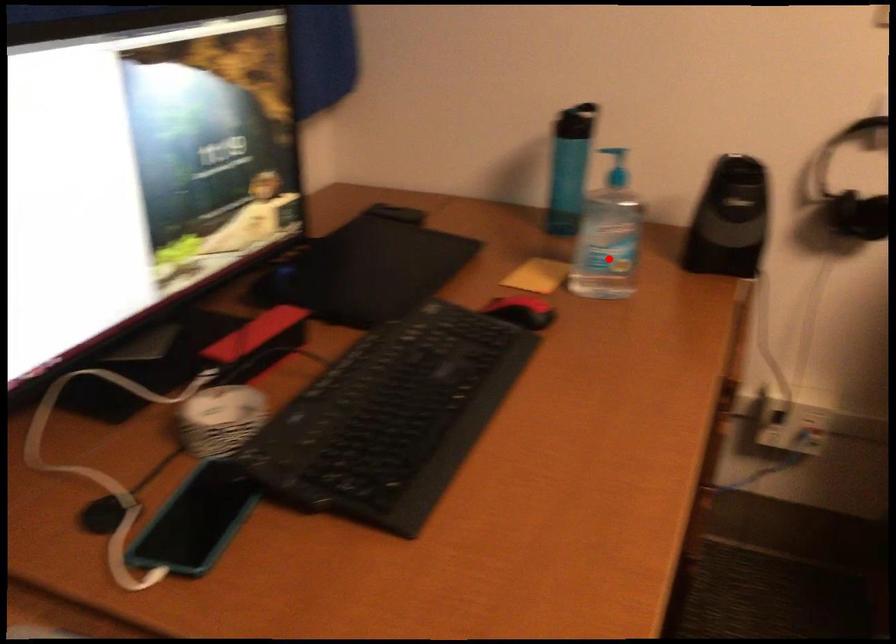
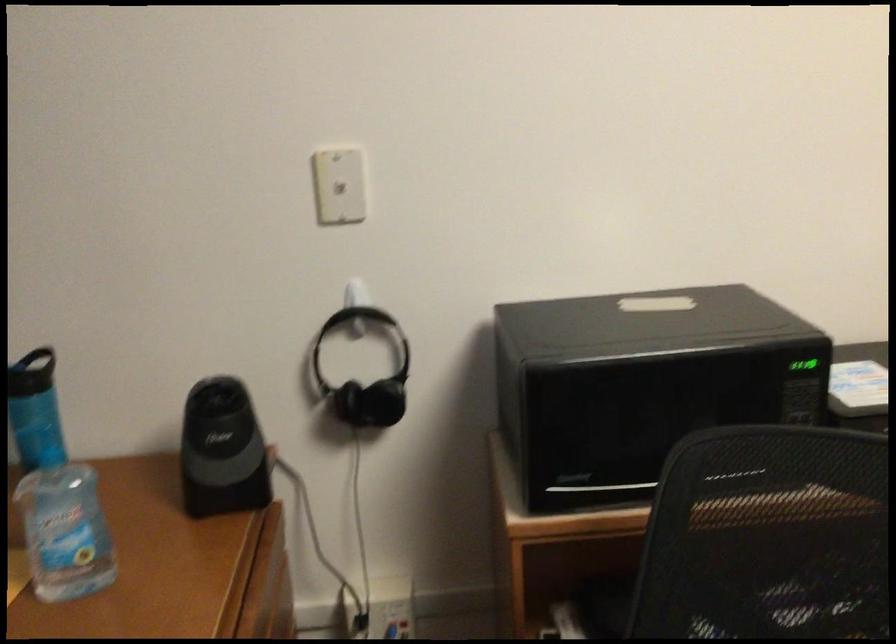
Question: I am providing you with two images of the same scene from different viewpoints. Given a red point in image1, look at the same physical point in image2. Is it:

Choices:
 (A) Closer to the viewpoint
 (B) Farther from the viewpoint

Answer: (A)